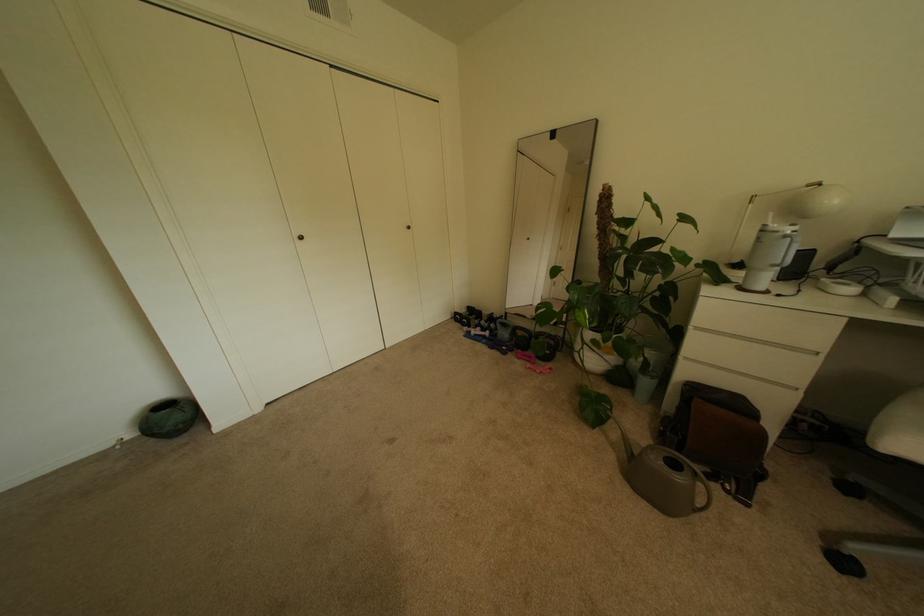
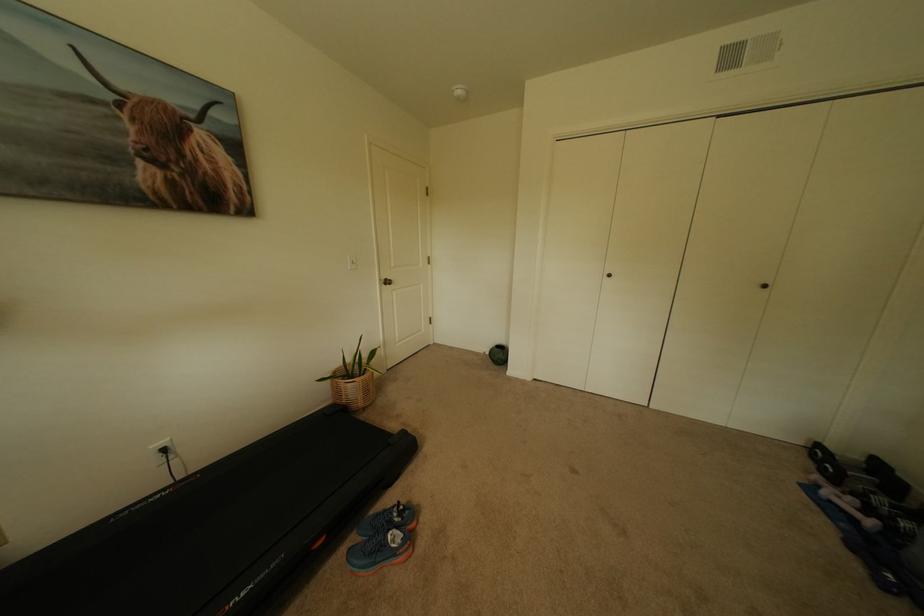
Find the pixel in the second image that matches (466,317) in the first image.

(827, 452)